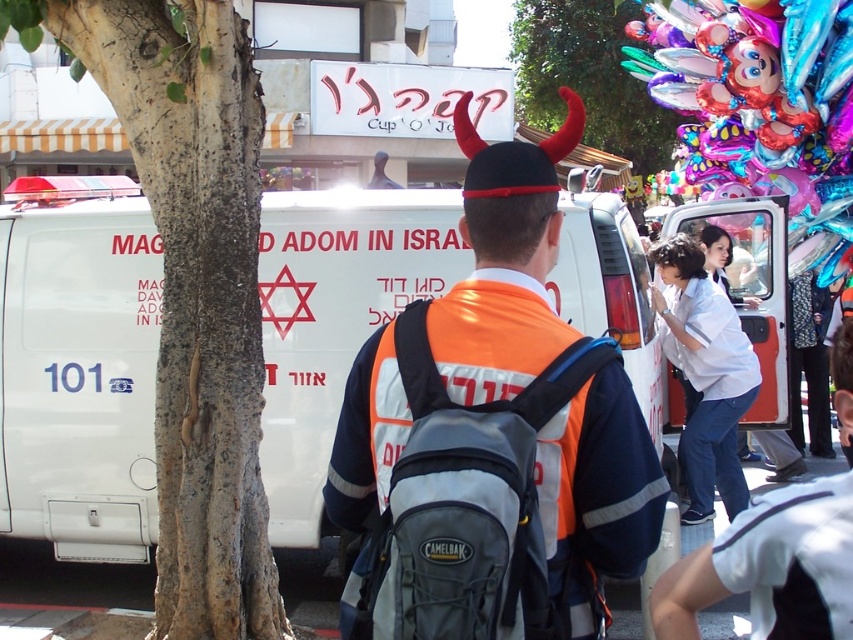
Question: Does orange reflective vest at center appear under white cotton shirt at right?

Choices:
 (A) no
 (B) yes

Answer: (A)

Question: Considering the real-world distances, which object is closest to the orange reflective vest at center?

Choices:
 (A) white cotton shirt at right
 (B) smooth bark tree at left
 (C) white van at center
 (D) shiny metallic clown at upper right

Answer: (B)

Question: Which point appears farthest from the camera in this image?

Choices:
 (A) (664, 157)
 (B) (9, 435)

Answer: (A)

Question: In this image, where is smooth bark tree at left located relative to shiny metallic clown at upper right?

Choices:
 (A) above
 (B) below

Answer: (B)

Question: Which point appears farthest from the camera in this image?

Choices:
 (A) (163, 42)
 (B) (693, 298)
 (C) (555, 33)

Answer: (C)

Question: Does white van at center lie in front of shiny metallic clown at upper right?

Choices:
 (A) no
 (B) yes

Answer: (B)